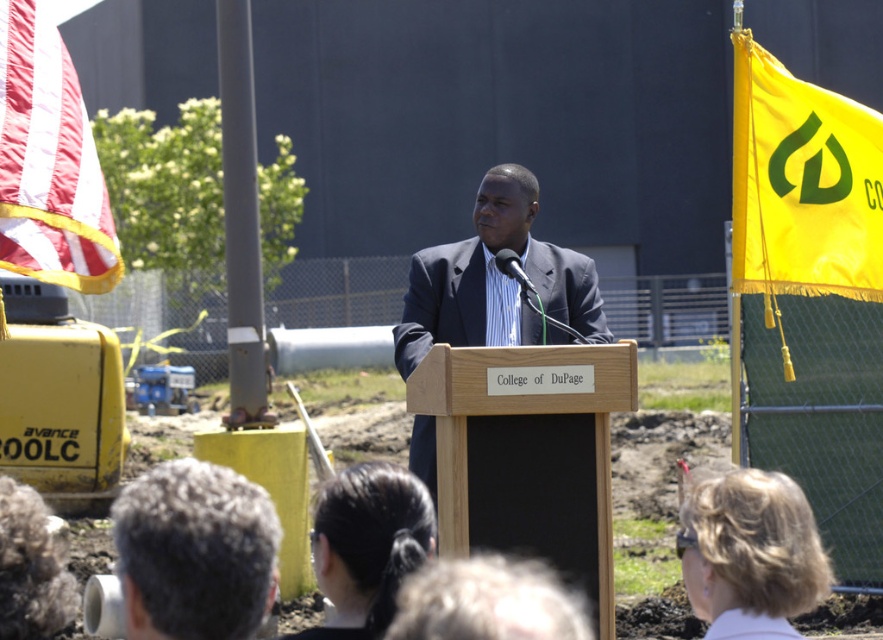
Between wooden podium at center and gray hair at center, which one appears on the left side from the viewer's perspective?

Positioned to the left is gray hair at center.

Is the position of wooden podium at center more distant than that of gray hair at center?

Yes, it is behind gray hair at center.

Locate an element on the screen. The width and height of the screenshot is (883, 640). wooden podium at center is located at coordinates (527, 452).

Measure the distance between gray hair at center and dark blue suit at center.

4.26 meters

Looking at this image, which is below, gray hair at center or dark blue suit at center?

Positioned lower is dark blue suit at center.

Is point (140, 588) in front of point (482, 326)?

Yes, point (140, 588) is in front of point (482, 326).

You are a GUI agent. You are given a task and a screenshot of the screen. Output one action in this format:
    pyautogui.click(x=<x>, y=<y>)
    Task: Click on the gray hair at center
    
    Given the screenshot: What is the action you would take?
    pyautogui.click(x=195, y=552)

Is yellow fabric flag at upper right above red-white striped fabric at upper left?

Indeed, yellow fabric flag at upper right is positioned over red-white striped fabric at upper left.

Is the position of yellow fabric flag at upper right less distant than that of red-white striped fabric at upper left?

No, yellow fabric flag at upper right is further to the viewer.

This screenshot has height=640, width=883. Find the location of `yellow fabric flag at upper right`. yellow fabric flag at upper right is located at coordinates (802, 182).

The width and height of the screenshot is (883, 640). In order to click on yellow fabric flag at upper right in this screenshot , I will do `click(802, 182)`.